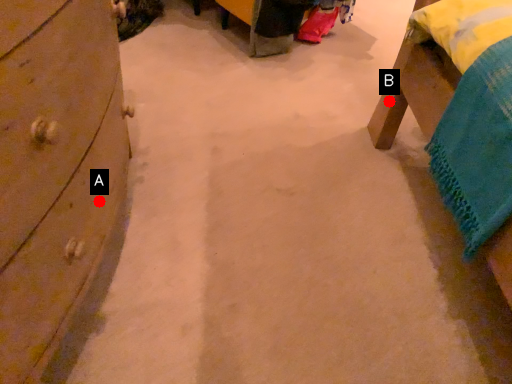
Question: Two points are circled on the image, labeled by A and B beside each circle. Among these points, which one is nearest to the camera?

Choices:
 (A) A is closer
 (B) B is closer

Answer: (A)